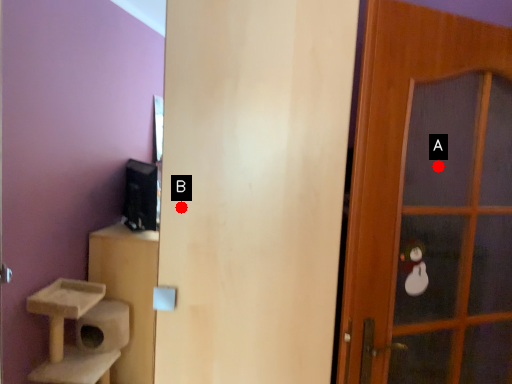
Question: Two points are circled on the image, labeled by A and B beside each circle. Which point is farther from the camera taking this photo?

Choices:
 (A) A is further
 (B) B is further

Answer: (A)